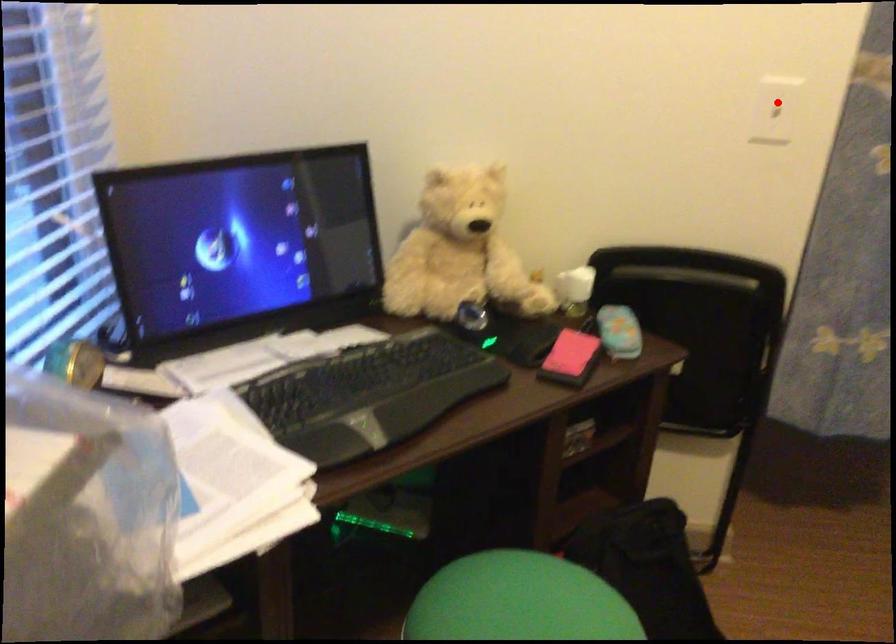
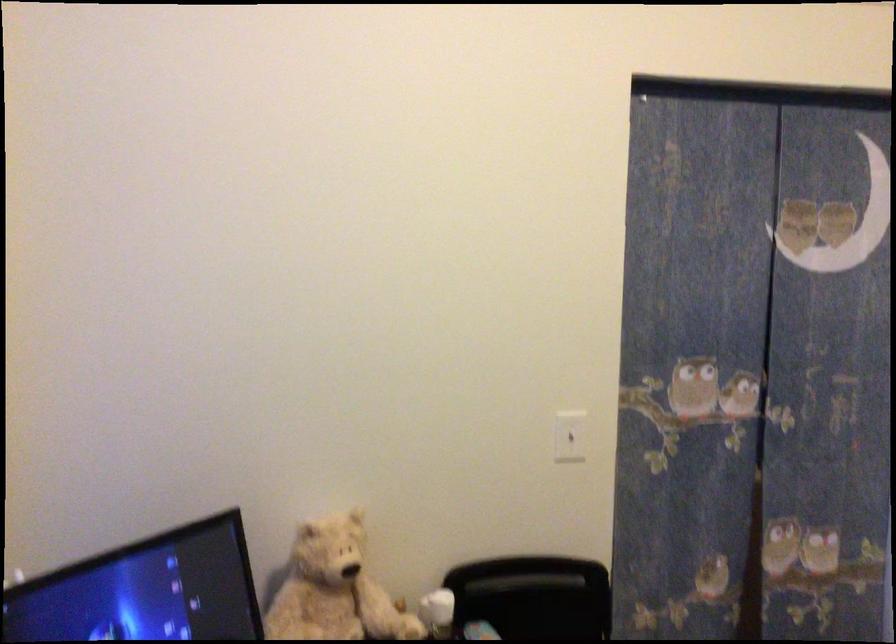
Where in the second image is the point corresponding to the highlighted location from the first image?

(570, 436)